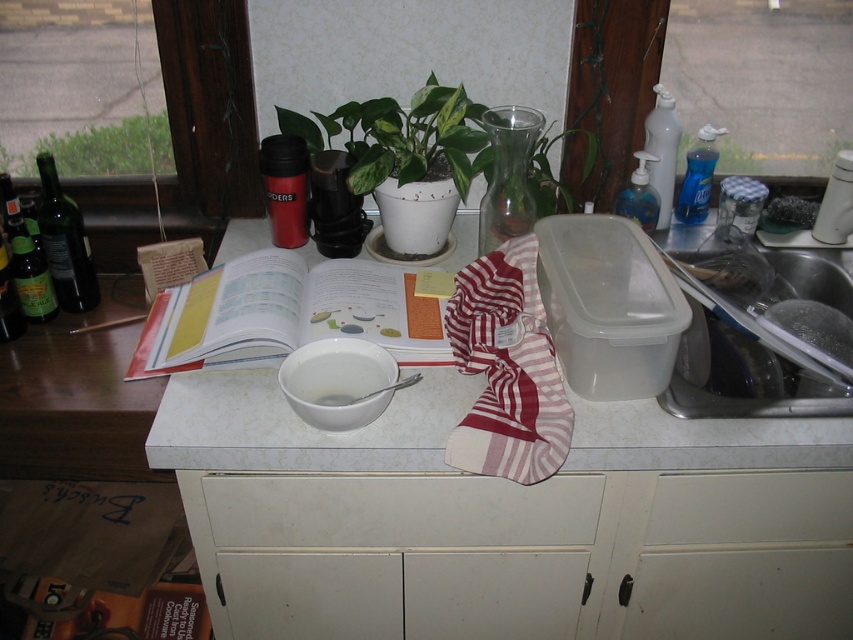
Based on the photo, you are standing in front of the kitchen countertop scene. You want to place a 4 feet long decorative item on the countertop. Is there enough space between you and the transparent glass vase at upper center to place it without moving any other items?

The distance between you and the transparent glass vase at upper center is 3.79 feet. Since the decorative item is 4 feet long, it would not fit within that space without moving other items.

You are organizing items on the kitchen countertop and need to place a new spice jar that requires 60 centimeters of space between it and the nearest object. You see the white matte drawer at center and the transparent plastic soap dispenser at upper right. Can you place the spice jar between them?

The distance between the white matte drawer at center and the transparent plastic soap dispenser at upper right is 64.25 centimeters. Since the required space is 60 centimeters, the spice jar can be placed between them as there is sufficient space.

You have a 10 cm wide object that you need to place on the countertop. The white matte drawer at center and the clear plastic bottle at upper right are both available spaces. Which one can accommodate your object based on their widths?

The white matte drawer at center is wider than the clear plastic bottle at upper right, so it can accommodate the 10 cm wide object.